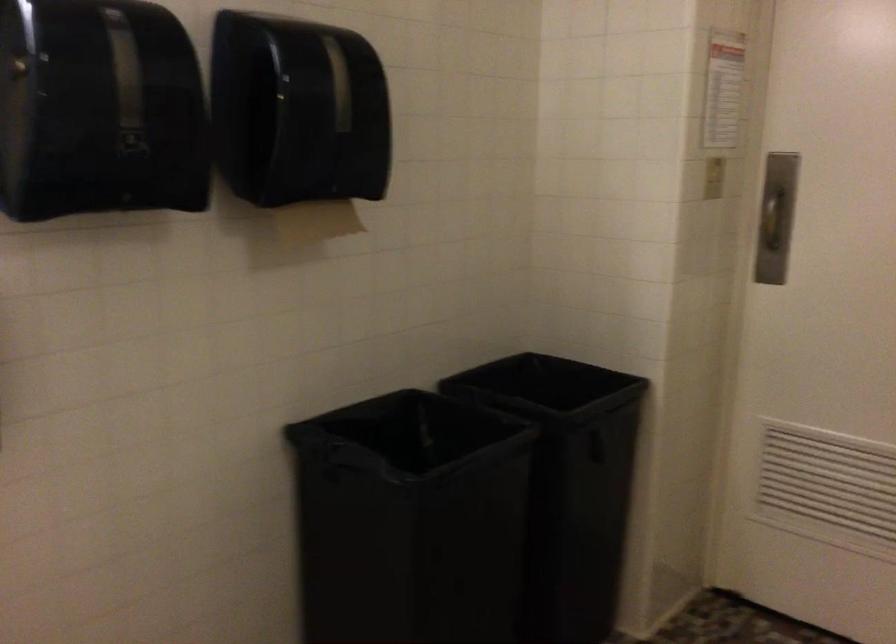
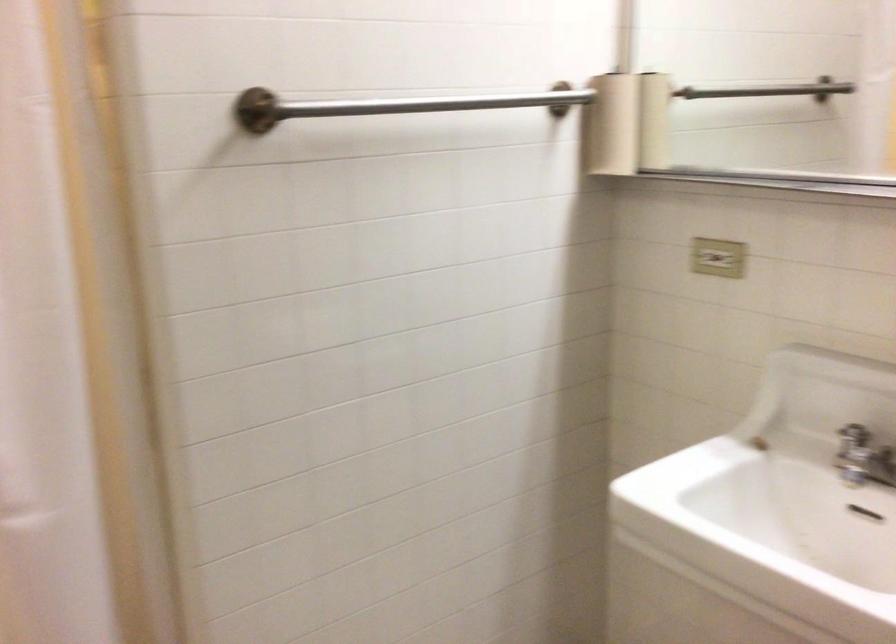
How did the camera likely rotate?

The camera's rotation is toward left-down.